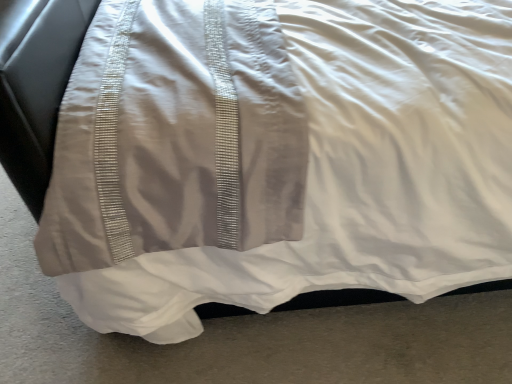
What do you see at coordinates (176, 136) in the screenshot? The width and height of the screenshot is (512, 384). I see `satin beige robe at center` at bounding box center [176, 136].

Identify the location of satin beige robe at center. (176, 136).

What is the approximate width of satin beige robe at center?

20.45 inches.

Locate an element on the screen. This screenshot has width=512, height=384. satin beige robe at center is located at coordinates (176, 136).